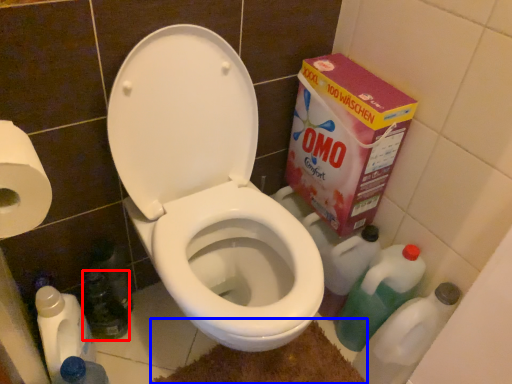
Question: Among these objects, which one is nearest to the camera, bottle (highlighted by a red box) or bath mat (highlighted by a blue box)?

Choices:
 (A) bottle
 (B) bath mat

Answer: (B)